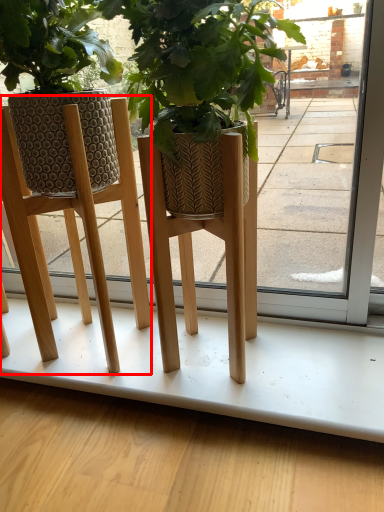
Question: From the image, what is the correct spatial relationship of furniture (annotated by the red box) in relation to pavement?

Choices:
 (A) right
 (B) left

Answer: (B)